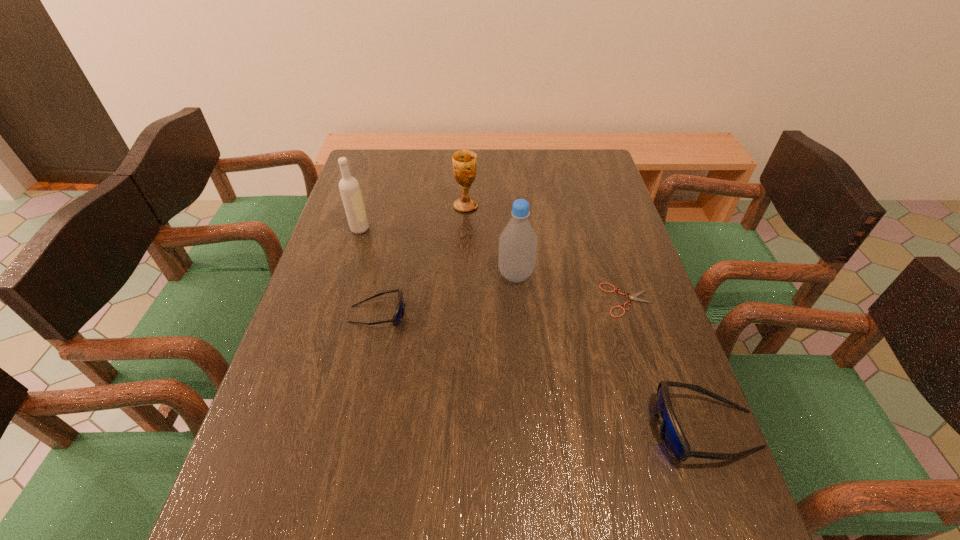
Please point a space for a new sunglasses to maintain equal intervals. Please provide its 2D coordinates. Your answer should be formatted as a tuple, i.e. [(x, y)], where the tuple contains the x and y coordinates of a point satisfying the conditions above.

[(524, 365)]